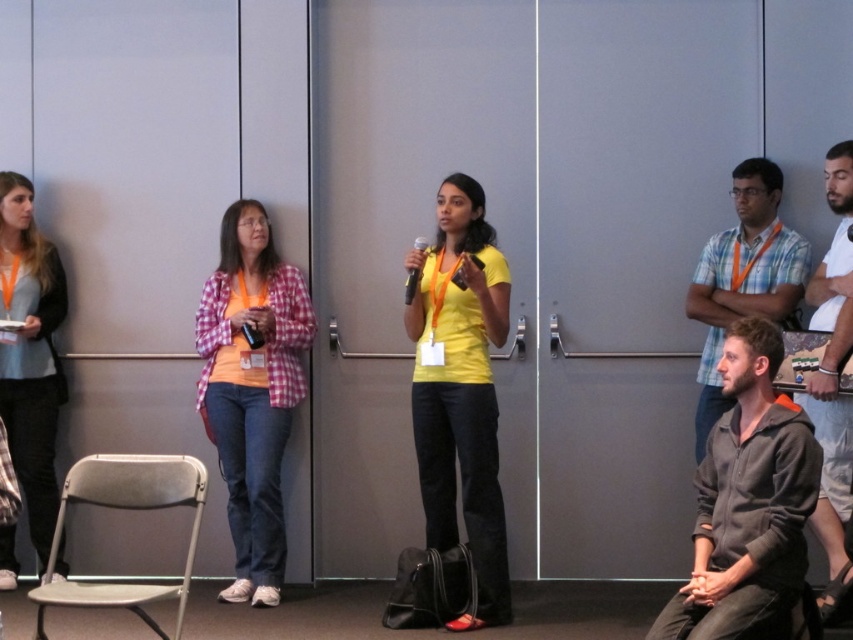
You are organizing a small event and need to place a new table between the gray fleece jacket at lower right and the metallic gray folding chair at lower left. Based on their current positions, which side of the chair should the table be placed to ensure it aligns with the existing arrangement?

The gray fleece jacket at lower right is positioned on the right side of the metallic gray folding chair at lower left. Therefore, placing the table to the right of the metallic gray folding chair at lower left would align with the existing arrangement.

In the conference room scene, there is a yellow matte shirt at center and a blue plaid shirt at right. From the perspective of someone facing the front of the room, which shirt is positioned to the left?

The yellow matte shirt at center is positioned to the left of the blue plaid shirt at right from the perspective of someone facing the front of the room.